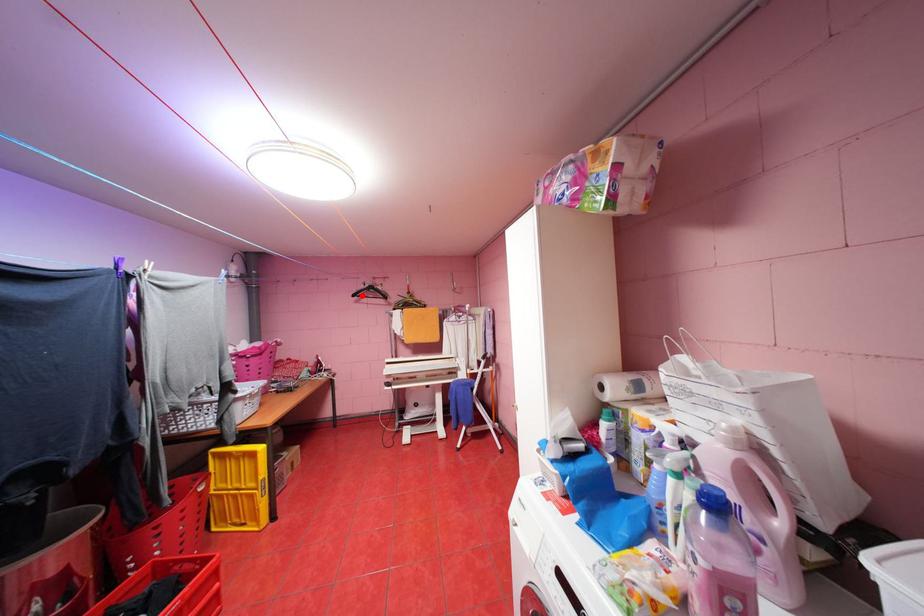
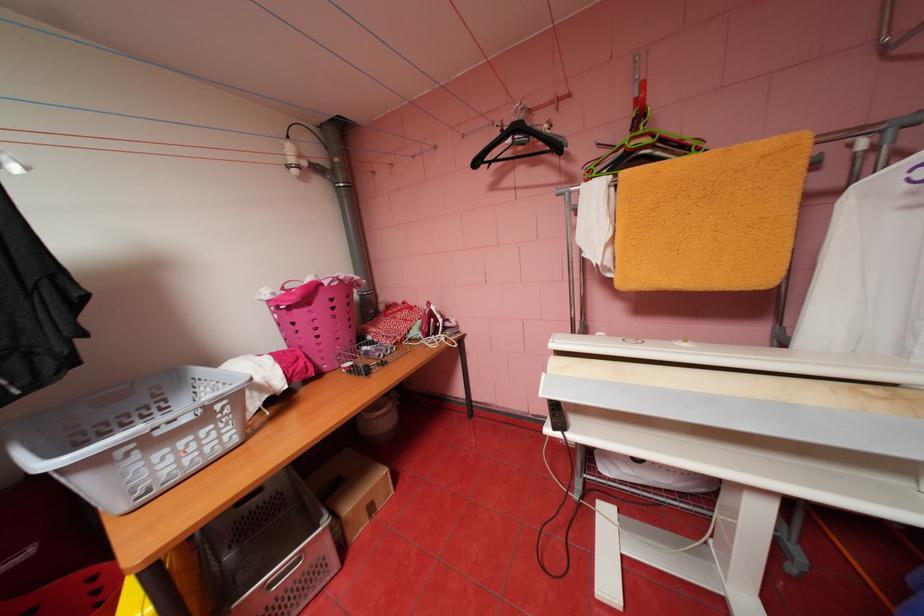
Where in the second image is the point corresponding to the highlighted location from the first image?

(484, 163)